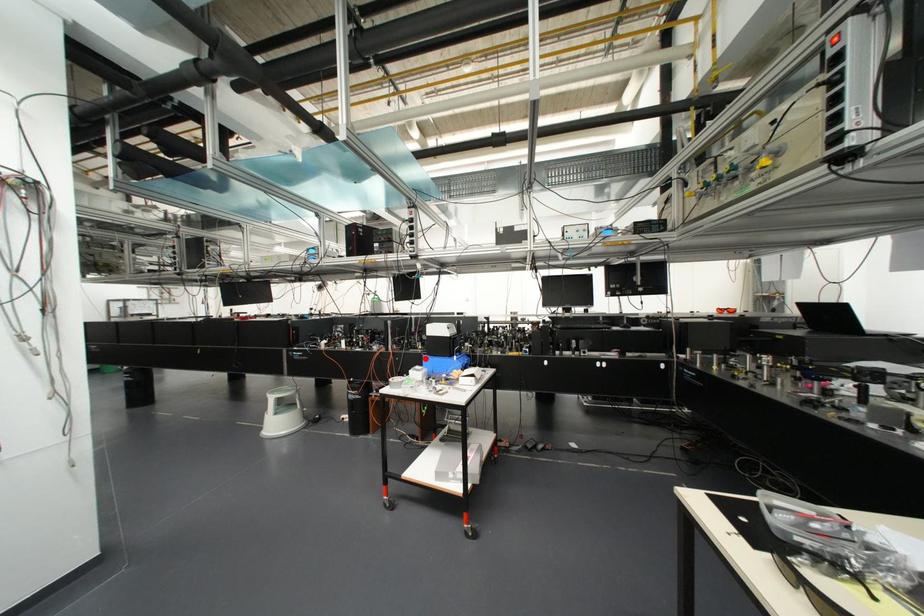
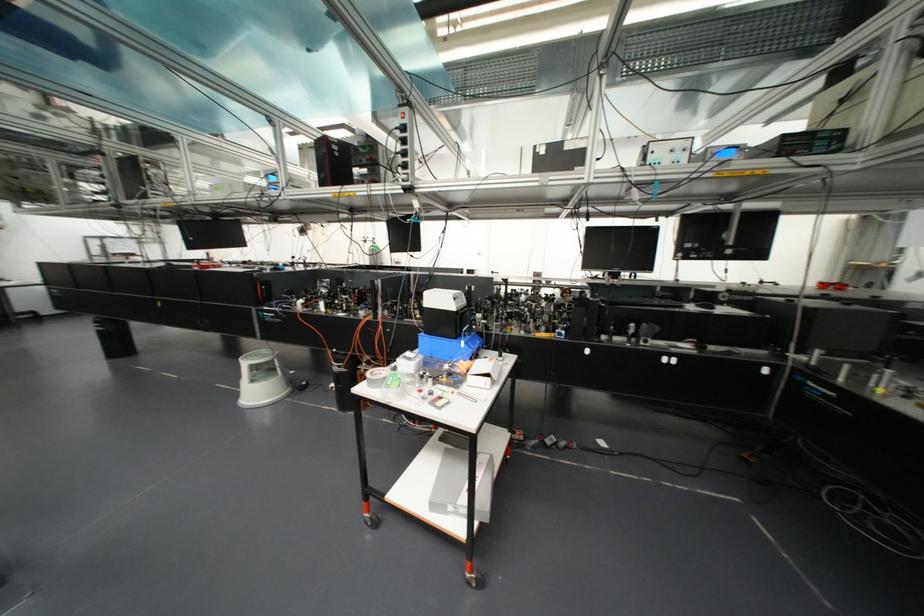
In the second image, find the point that corresponds to the highlighted location in the first image.

(422, 338)